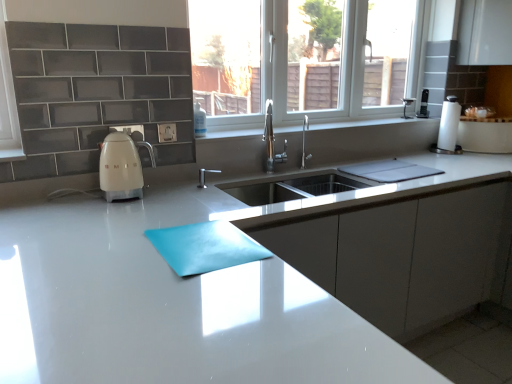
Describe the element at coordinates (205, 247) in the screenshot. I see `teal glossy placemat at center` at that location.

What do you see at coordinates (377, 125) in the screenshot? This screenshot has height=384, width=512. I see `white glossy window sill at center` at bounding box center [377, 125].

The height and width of the screenshot is (384, 512). What are the coordinates of `white glossy countertop at center` in the screenshot? It's located at (248, 284).

Identify the location of teal glossy placemat at center. (205, 247).

Looking at this image, considering the relative sizes of teal glossy placemat at center and polished chrome tap at center in the image provided, is teal glossy placemat at center thinner than polished chrome tap at center?

In fact, teal glossy placemat at center might be wider than polished chrome tap at center.

In the scene shown: In the image, is teal glossy placemat at center on the left side or the right side of polished chrome tap at center?

From the image, it's evident that teal glossy placemat at center is to the left of polished chrome tap at center.

Between teal glossy placemat at center and polished chrome tap at center, which one is positioned in front?

teal glossy placemat at center is more forward.

From a real-world perspective, which object rests below the other?

From a 3D spatial view, teal glossy placemat at center is below.

Could white glossy kettle at left be considered to be inside transparent glass window at center?

No, white glossy kettle at left is located outside of transparent glass window at center.

Is transparent glass window at center positioned before white glossy kettle at left?

No, transparent glass window at center is further to the viewer.

From a real-world perspective, is transparent glass window at center physically below white glossy kettle at left?

No, from a real-world perspective, transparent glass window at center is not below white glossy kettle at left.

In terms of width, does transparent glass window at center look wider or thinner when compared to white glossy kettle at left?

transparent glass window at center is thinner than white glossy kettle at left.

From the picture: In terms of height, does polished chrome tap at center look taller or shorter compared to white glossy window sill at center?

polished chrome tap at center is taller than white glossy window sill at center.

Does point (308, 126) come in front of point (432, 139)?

That is True.

Is polished chrome tap at center not near white glossy window sill at center?

They are positioned close to each other.

Which is more to the right, teal glossy placemat at center or transparent glass window at center?

transparent glass window at center.

Considering the sizes of teal glossy placemat at center and transparent glass window at center in the image, is teal glossy placemat at center wider or thinner than transparent glass window at center?

Clearly, teal glossy placemat at center has more width compared to transparent glass window at center.

How distant is teal glossy placemat at center from transparent glass window at center?

A distance of 4.72 feet exists between teal glossy placemat at center and transparent glass window at center.

Between teal glossy placemat at center and transparent glass window at center, which one has more height?

transparent glass window at center.

Does white glossy countertop at center have a larger size compared to transparent glass window at center?

Indeed, white glossy countertop at center has a larger size compared to transparent glass window at center.

Is white glossy countertop at center positioned with its back to transparent glass window at center?

No.

Is white glossy countertop at center surrounding transparent glass window at center?

No, transparent glass window at center is not inside white glossy countertop at center.

From the image's perspective, is white glossy countertop at center located above transparent glass window at center?

Incorrect, from the image's perspective, white glossy countertop at center is lower than transparent glass window at center.

Looking at their sizes, would you say polished chrome tap at center is wider or thinner than white glossy kettle at left?

Considering their sizes, polished chrome tap at center looks slimmer than white glossy kettle at left.

Considering the points (301, 165) and (130, 195), which point is in front, point (301, 165) or point (130, 195)?

The point (130, 195) is in front.

Who is smaller, polished chrome tap at center or white glossy kettle at left?

polished chrome tap at center is smaller.

From the image's perspective, who appears lower, polished chrome tap at center or white glossy kettle at left?

white glossy kettle at left appears lower in the image.

Is white paper towel at right taller than teal glossy placemat at center?

Correct, white paper towel at right is much taller as teal glossy placemat at center.

Is white paper towel at right to the right of teal glossy placemat at center from the viewer's perspective?

Correct, you'll find white paper towel at right to the right of teal glossy placemat at center.

Is white paper towel at right smaller than teal glossy placemat at center?

No.

This screenshot has height=384, width=512. I want to click on tap above the teal glossy placemat at center (from a real-world perspective), so click(304, 142).

The width and height of the screenshot is (512, 384). Identify the location of home appliance to the left of transparent glass window at center. (122, 166).

Which object lies further to the anchor point clear plastic soap dispenser at upper center, polished chrome tap at center or transparent glass window at center?

transparent glass window at center is positioned further to the anchor clear plastic soap dispenser at upper center.

Considering their positions, is transparent glass window at center positioned further to white paper towel at right than clear plastic soap dispenser at upper center?

clear plastic soap dispenser at upper center is positioned further to the anchor white paper towel at right.

Consider the image. Considering their positions, is transparent glass window at center positioned closer to polished chrome tap at center than white paper towel at right?

transparent glass window at center is positioned closer to the anchor polished chrome tap at center.

From the image, which object appears to be farther from clear plastic soap dispenser at upper center, white glossy kettle at left or transparent glass window at center?

Among the two, transparent glass window at center is located further to clear plastic soap dispenser at upper center.

When comparing their distances from white glossy kettle at left, does white glossy window sill at center or white glossy countertop at center seem closer?

white glossy window sill at center is closer to white glossy kettle at left.

Looking at the image, which one is located further to clear plastic soap dispenser at upper center, white paper towel at right or white glossy kettle at left?

white paper towel at right.

When comparing their distances from white glossy countertop at center, does transparent glass window at center or teal glossy placemat at center seem closer?

teal glossy placemat at center is closer to white glossy countertop at center.

When comparing their distances from teal glossy placemat at center, does white glossy countertop at center or transparent glass window at center seem closer?

The object closer to teal glossy placemat at center is white glossy countertop at center.

Where is `window sill between teal glossy placemat at center and polished chrome tap at center from front to back`? window sill between teal glossy placemat at center and polished chrome tap at center from front to back is located at coordinates (377, 125).

At what (x,y) coordinates should I click in order to perform the action: click on window located between white glossy kettle at left and white glossy window sill at center in the left-right direction. Please return your answer as a coordinate pair (x, y). This screenshot has width=512, height=384. Looking at the image, I should click on (331, 64).

You are a GUI agent. You are given a task and a screenshot of the screen. Output one action in this format:
    pyautogui.click(x=<x>, y=<y>)
    Task: Click on the home appliance between teal glossy placemat at center and clear plastic soap dispenser at upper center along the z-axis
    
    Given the screenshot: What is the action you would take?
    pyautogui.click(x=122, y=166)

The image size is (512, 384). In order to click on window situated between polished chrome tap at center and white paper towel at right from left to right in this screenshot , I will do `click(331, 64)`.